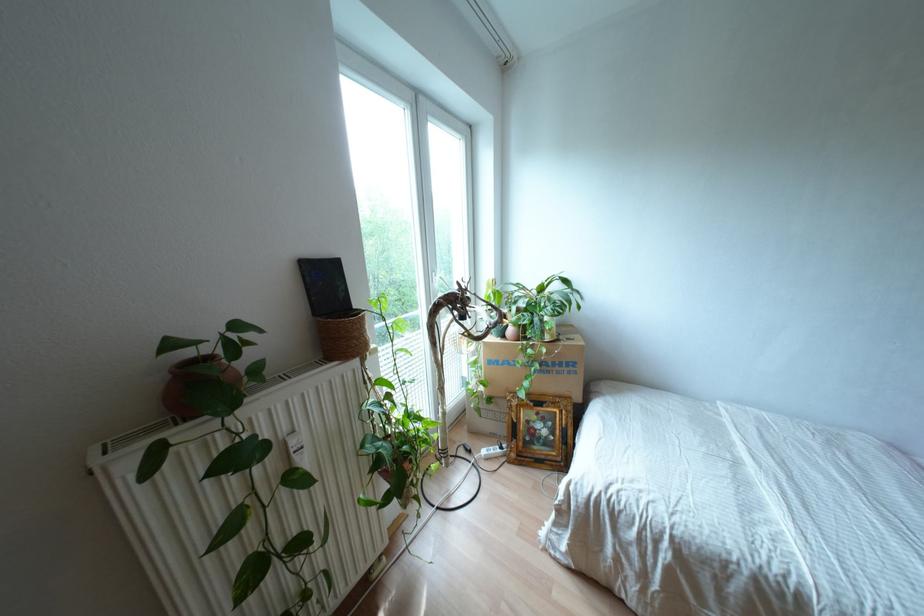
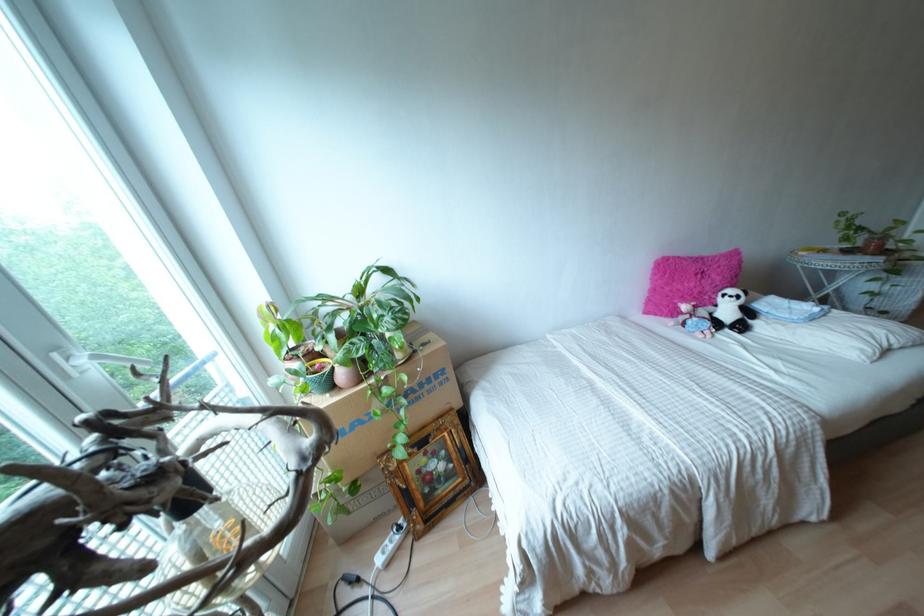
Find the pixel in the second image that matches point 530,424 in the first image.

(423, 469)